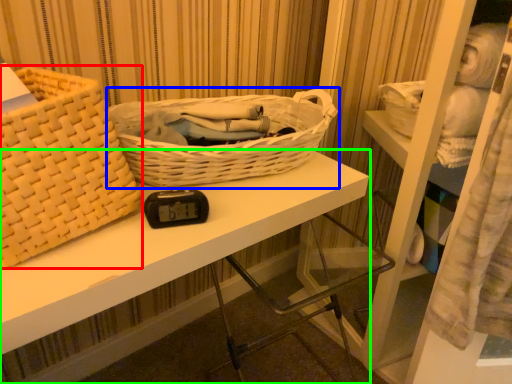
Question: Estimate the real-world distances between objects in this image. Which object is closer to picnic basket (highlighted by a red box), picnic basket (highlighted by a blue box) or desk (highlighted by a green box)?

Choices:
 (A) picnic basket
 (B) desk

Answer: (B)